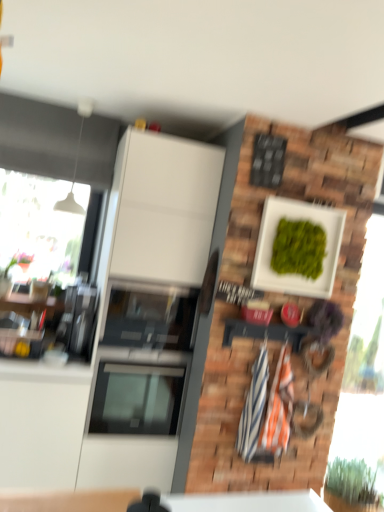
Question: Is point (352, 480) positioned closer to the camera than point (52, 4)?

Choices:
 (A) farther
 (B) closer

Answer: (A)

Question: In terms of height, does green leafy plant at lower right look taller or shorter compared to white matte wall at upper center?

Choices:
 (A) tall
 (B) short

Answer: (A)

Question: Estimate the real-world distances between objects in this image. Which object is closer to the green leafy plant at lower right?

Choices:
 (A) white glossy cabinet at center
 (B) white matte wall at upper center

Answer: (A)

Question: Estimate the real-world distances between objects in this image. Which object is farther from the green leafy plant at lower right?

Choices:
 (A) white glossy cabinet at center
 (B) white matte wall at upper center

Answer: (B)